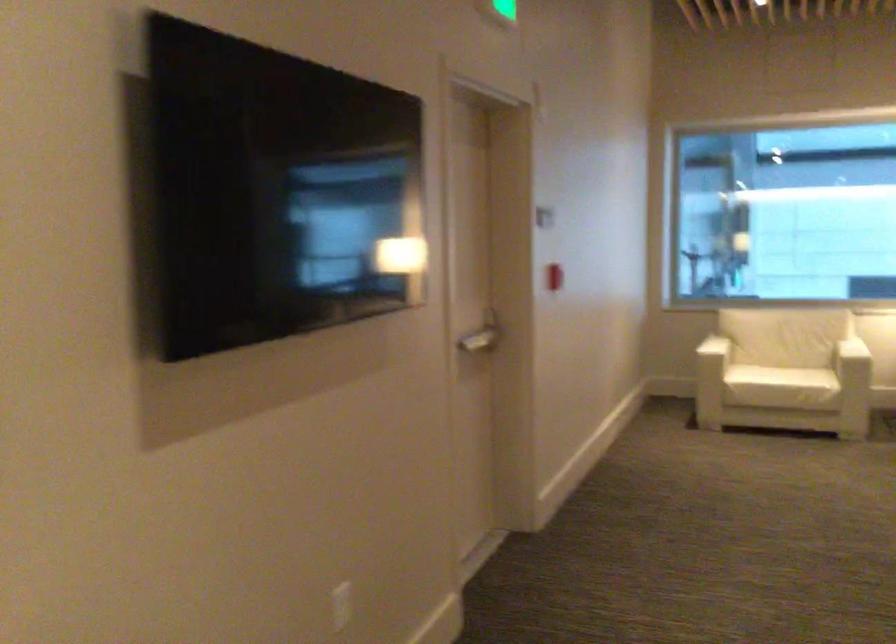
The image size is (896, 644). What do you see at coordinates (780, 377) in the screenshot?
I see `a chair sitting surface` at bounding box center [780, 377].